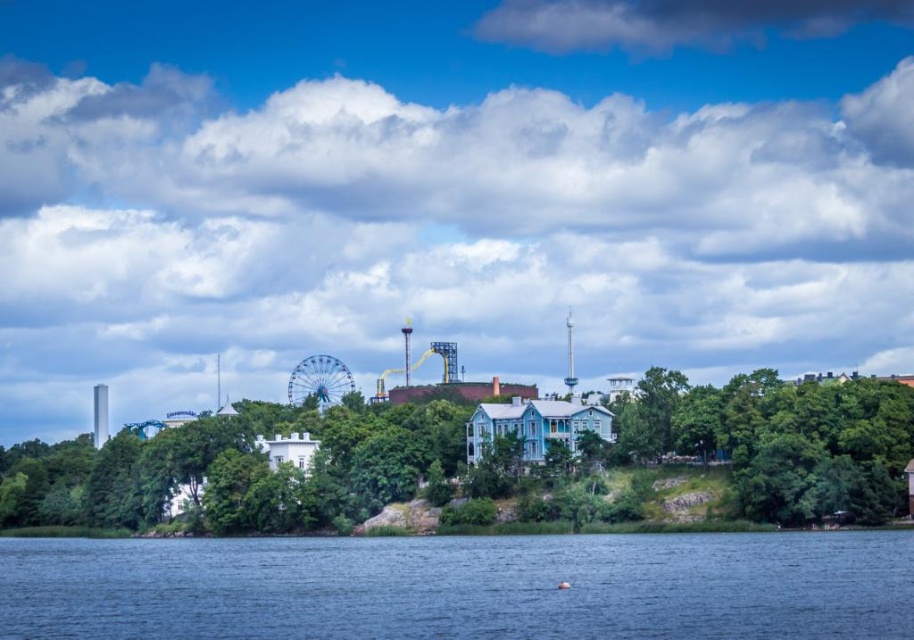
You are standing at the waterfront and want to take a photo that includes both the metallic ferris wheel at center and the blue water at lower center. Based on their positions, which object should you position closer to the foreground of your photo?

The metallic ferris wheel at center is further to the viewer than the blue water at lower center, so you should position the metallic ferris wheel at center closer to the foreground to include both in the photo.

You are standing at the waterfront and want to take a photo that includes both the metallic ferris wheel at center and the blue water at lower center. Which object should you position closer to the center of your camera frame to ensure both are fully visible?

You should position the metallic ferris wheel at center closer to the center of your camera frame since it has a greater height compared to the blue water at lower center, ensuring both are fully visible.

You are standing at the point closer to the camera between the two points, point (x=277, y=525) and point (x=881, y=531). Looking towards the waterfront area, which direction would you face? The scene has calm dark blue water in the foreground, buildings in the middle ground, and trees and amusement rides in the background.

Since point (x=277, y=525) is closer to the camera than point (x=881, y=531), you are standing at point (x=277, y=525). Facing towards the waterfront area with calm dark blue water in the foreground, you would be facing towards the lower part of the scene where the water is located.